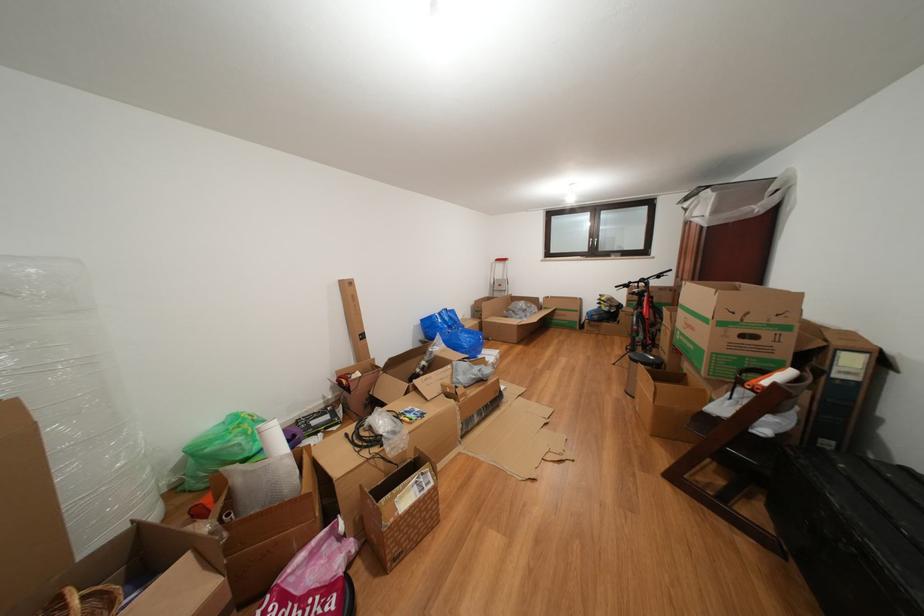
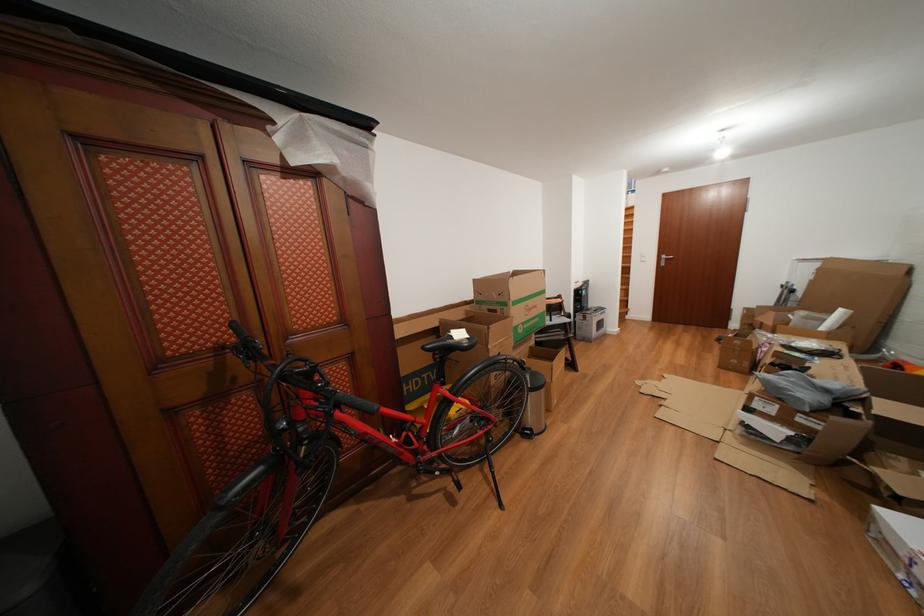
Locate, in the second image, the point that corresponds to pixel 700 334 in the first image.

(543, 312)